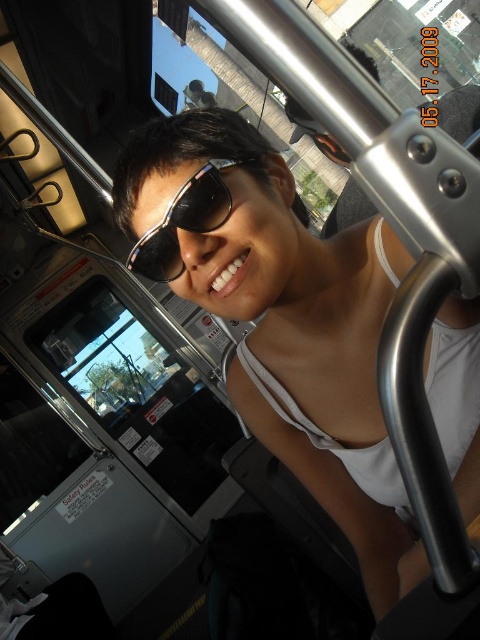
You are designing a virtual reality simulation of this bus interior. To accurately place the white matte tank top at center in the 3D space, what are the coordinates you should use based on the 2D location provided?

The coordinates for the white matte tank top at center should be based on the 2D location provided, which is at point (280, 317). However, without additional depth information, it is not possible to determine the exact 3D coordinates. Please provide more details about the depth or perspective of the image to calculate the third dimension.

You are a passenger on a bus and want to reach a point marked as point (167, 225) in the image. If you are currently 74.22 centimeters away from this point, can you comfortably extend your arm to touch it without moving your feet?

The point (167, 225) is 74.22 centimeters away from you. Since the average human arm length is about 70 centimeters, you might need to stretch slightly but it could be possible depending on your flexibility. However, this requires not moving your feet. If your arm isn not long enough, you might not reach it without moving.

You are a fashion designer analyzing clothing proportions. You observe a person wearing a white matte tank top at center and sunglasses at center. Which item has a greater width?

The white matte tank top at center has a greater width than the sunglasses at center.